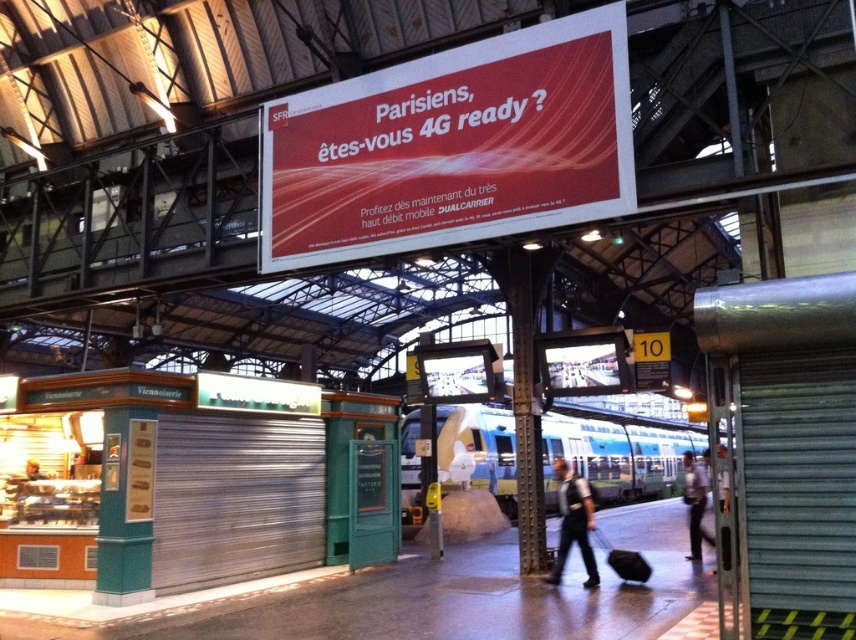
You are a photographer standing on the platform and want to capture both the light blue metallic train at center and the light blue shirt at right in a single photo. Considering their sizes, will the train occupy more of the frame than the shirt?

The light blue metallic train at center might be wider than light blue shirt at right, so it could occupy more of the frame in the photo.

What is the relationship between the size of the light blue metallic train at center and the light blue shirt at right in the image?

The light blue metallic train at center is larger in size than the light blue shirt at right.

What is the relationship between the widths of the dark blue uniform at center and the light blue shirt at right?

The dark blue uniform at center has a lesser width compared to the light blue shirt at right.